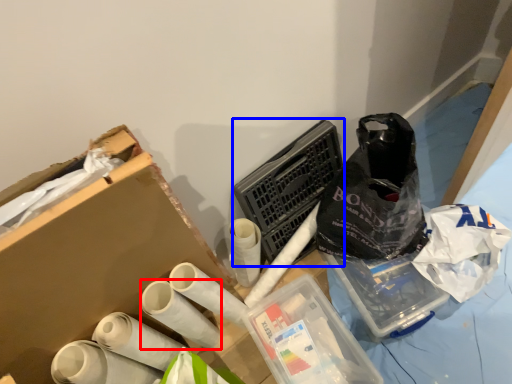
Question: Which point is further to the camera, toilet paper (highlighted by a red box) or laundry basket (highlighted by a blue box)?

Choices:
 (A) toilet paper
 (B) laundry basket

Answer: (B)